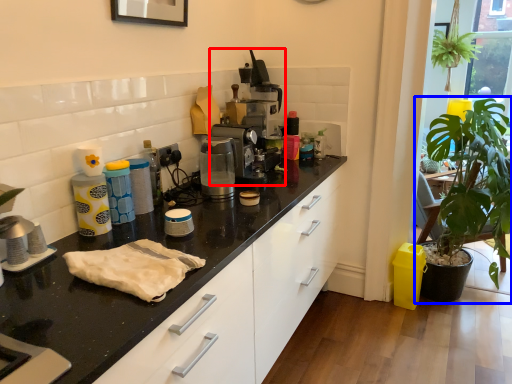
Question: Which object is further to the camera taking this photo, coffee machine (highlighted by a red box) or houseplant (highlighted by a blue box)?

Choices:
 (A) coffee machine
 (B) houseplant

Answer: (A)